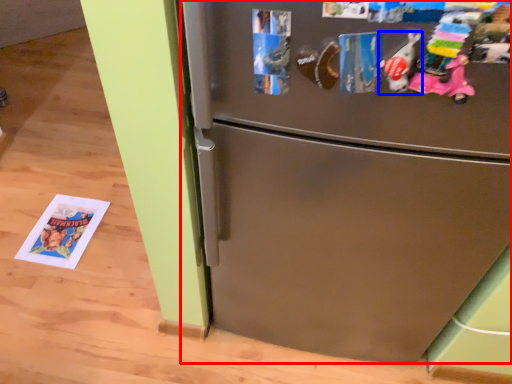
Question: Which object is closer to the camera taking this photo, refrigerator (highlighted by a red box) or toy (highlighted by a blue box)?

Choices:
 (A) refrigerator
 (B) toy

Answer: (B)